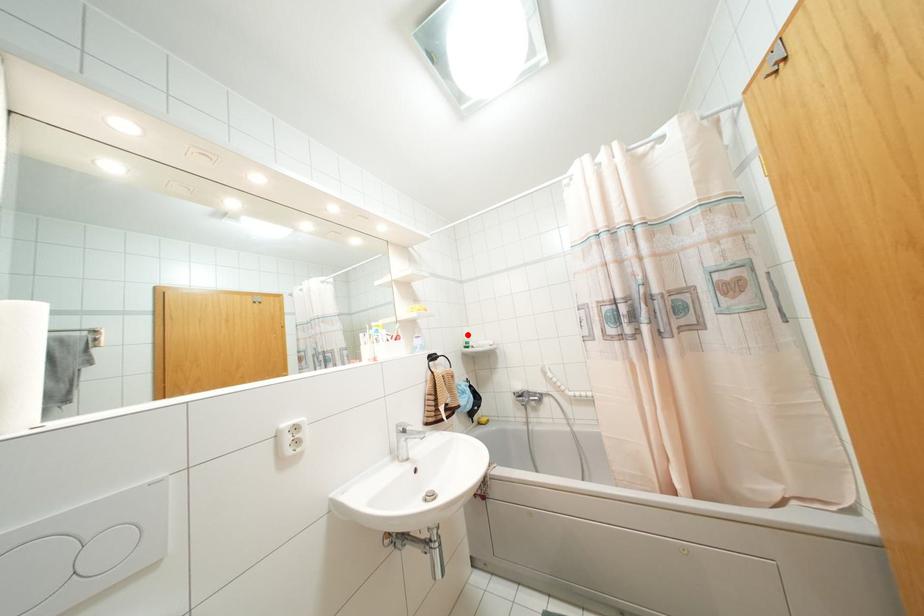
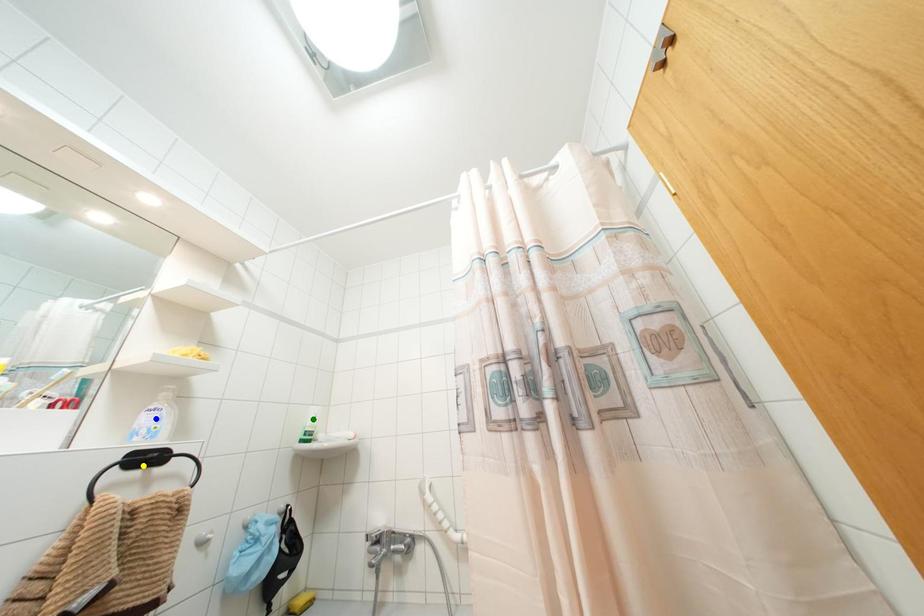
Question: I am providing you with two images of the same scene from different viewpoints. A red point is marked on the first image. You are given multiple points on the second image. Which mark in image 2 goes with the point in image 1?

Choices:
 (A) green point
 (B) yellow point
 (C) blue point

Answer: (A)